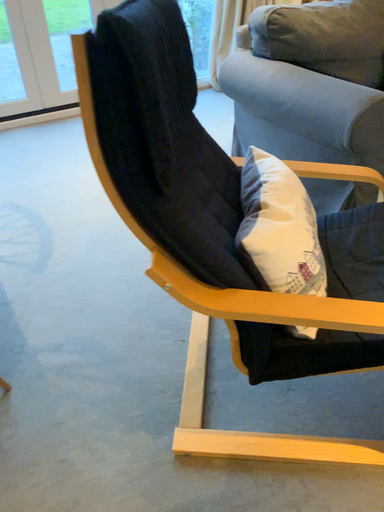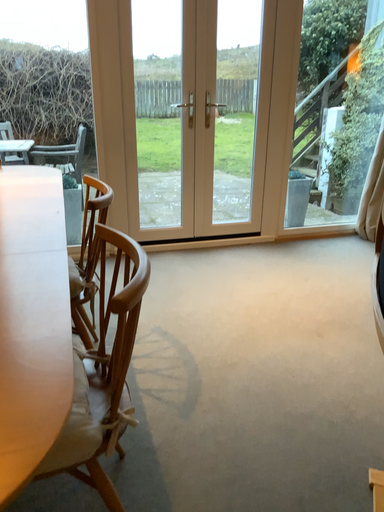
Question: Which way did the camera rotate in the video?

Choices:
 (A) rotated left
 (B) rotated right

Answer: (A)